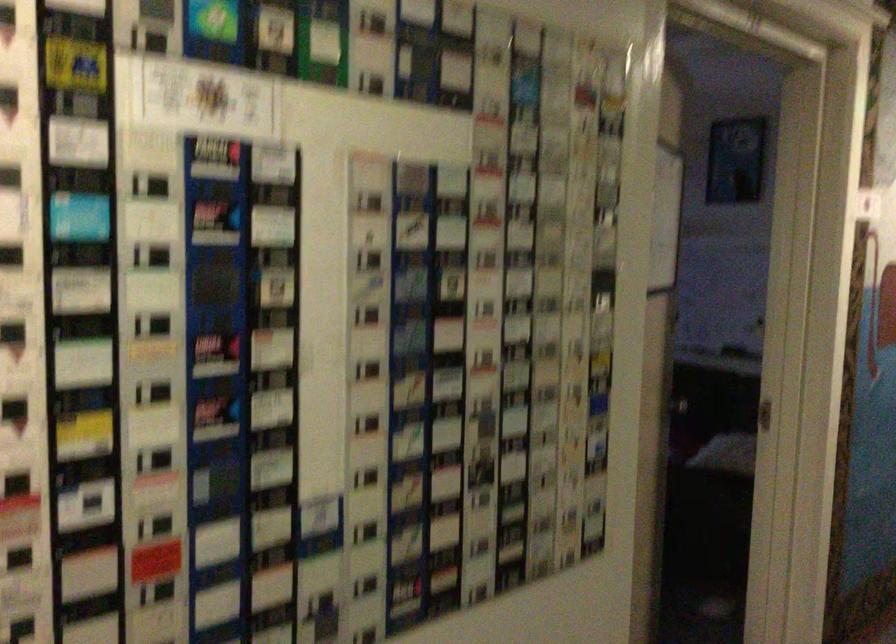
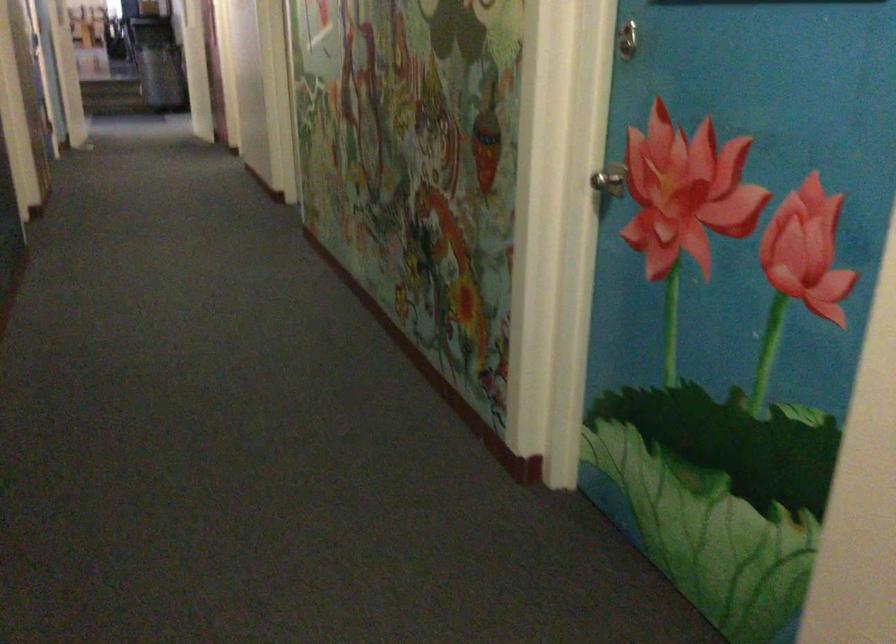
The first image is from the beginning of the video and the second image is from the end. How did the camera likely rotate when shooting the video?

The camera's rotation is toward left-down.